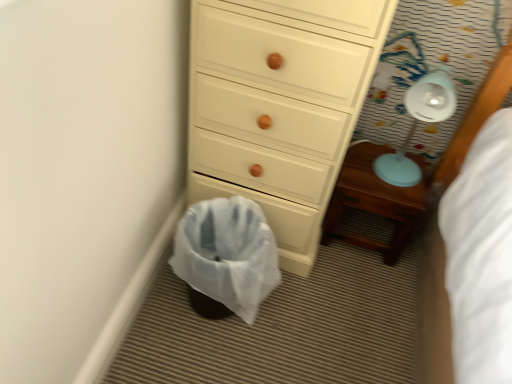
Question: From the image's perspective, does white plastic lamp at upper right appear higher than white wood chest of drawers at center?

Choices:
 (A) no
 (B) yes

Answer: (A)

Question: Does white plastic lamp at upper right come behind white wood chest of drawers at center?

Choices:
 (A) no
 (B) yes

Answer: (B)

Question: From a real-world perspective, is white plastic lamp at upper right positioned under white wood chest of drawers at center based on gravity?

Choices:
 (A) no
 (B) yes

Answer: (A)

Question: Can you confirm if white plastic lamp at upper right is wider than white wood chest of drawers at center?

Choices:
 (A) no
 (B) yes

Answer: (A)

Question: Are white plastic lamp at upper right and white wood chest of drawers at center making contact?

Choices:
 (A) yes
 (B) no

Answer: (B)

Question: Choose the correct answer: Is wooden nightstand at lower right inside white plastic laundry basket at lower center or outside it?

Choices:
 (A) outside
 (B) inside

Answer: (A)

Question: Is wooden nightstand at lower right taller or shorter than white plastic laundry basket at lower center?

Choices:
 (A) tall
 (B) short

Answer: (B)

Question: Looking at the image, does wooden nightstand at lower right seem bigger or smaller compared to white plastic laundry basket at lower center?

Choices:
 (A) small
 (B) big

Answer: (A)

Question: From a real-world perspective, is wooden nightstand at lower right physically located above or below white plastic laundry basket at lower center?

Choices:
 (A) below
 (B) above

Answer: (A)

Question: From the image's perspective, relative to white wood chest of drawers at center, is white plastic laundry basket at lower center above or below?

Choices:
 (A) below
 (B) above

Answer: (A)

Question: In the image, is white plastic laundry basket at lower center positioned in front of or behind white wood chest of drawers at center?

Choices:
 (A) behind
 (B) front

Answer: (A)

Question: Choose the correct answer: Is white plastic laundry basket at lower center inside white wood chest of drawers at center or outside it?

Choices:
 (A) outside
 (B) inside

Answer: (A)

Question: Considering the positions of white plastic laundry basket at lower center and white wood chest of drawers at center in the image, is white plastic laundry basket at lower center taller or shorter than white wood chest of drawers at center?

Choices:
 (A) tall
 (B) short

Answer: (B)

Question: In terms of height, does white wood chest of drawers at center look taller or shorter compared to white plastic laundry basket at lower center?

Choices:
 (A) tall
 (B) short

Answer: (A)

Question: Looking at the image, does white wood chest of drawers at center seem bigger or smaller compared to white plastic laundry basket at lower center?

Choices:
 (A) big
 (B) small

Answer: (A)